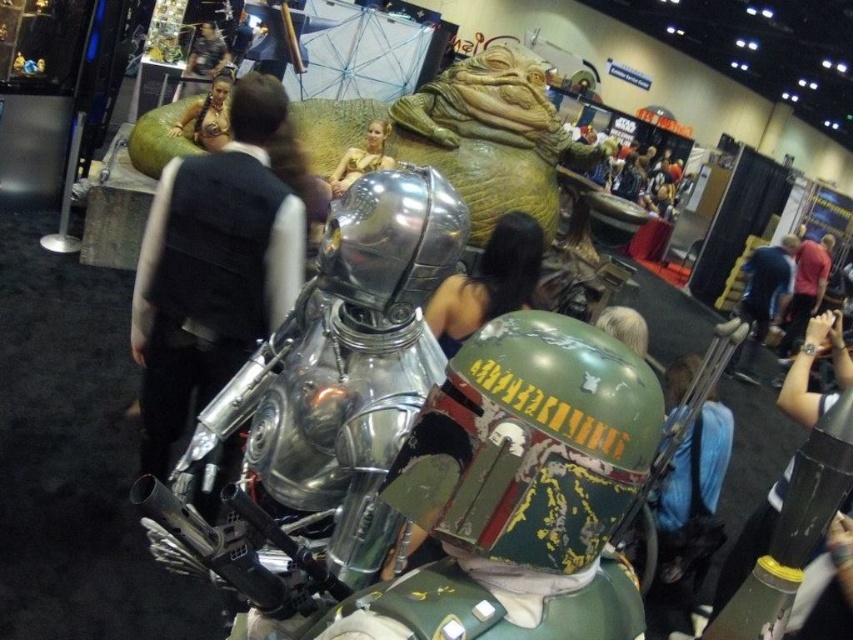
You are standing at the center of the convention hall and see two points marked in the image. The first point is at coordinates point (682, 369) and the second is at point (753, 342). Which point is closer to you?

Point (682, 369) is in front of point (753, 342), so it is closer to you.

You are organizing a cosplay costume competition and need to ensure all costumes are visible to the judges. The blue fabric shirt at right and the metallic gold bikini at upper center are part of two different costumes. Which costume has a larger piece of clothing?

The blue fabric shirt at right is bigger than the metallic gold bikini at upper center, so the costume with the blue fabric shirt at right has a larger piece of clothing.

You are a photographer at the event and need to capture both the metallic silver helmet at center and the blue fabric shirt at right in a single frame. Which object should you focus on first to ensure both are in the frame?

The metallic silver helmet at center has a lesser height compared to blue fabric shirt at right, so you should focus on the blue fabric shirt at right first to ensure both are in the frame.